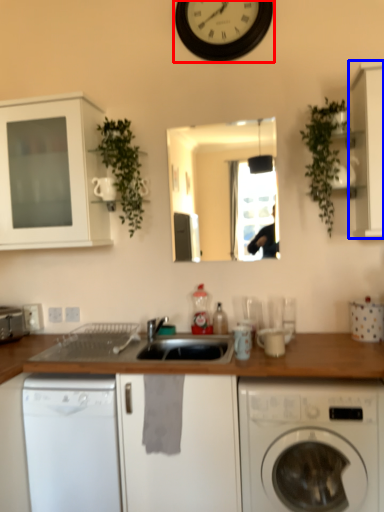
Question: Which point is closer to the camera, clock (highlighted by a red box) or cabinetry (highlighted by a blue box)?

Choices:
 (A) clock
 (B) cabinetry

Answer: (B)